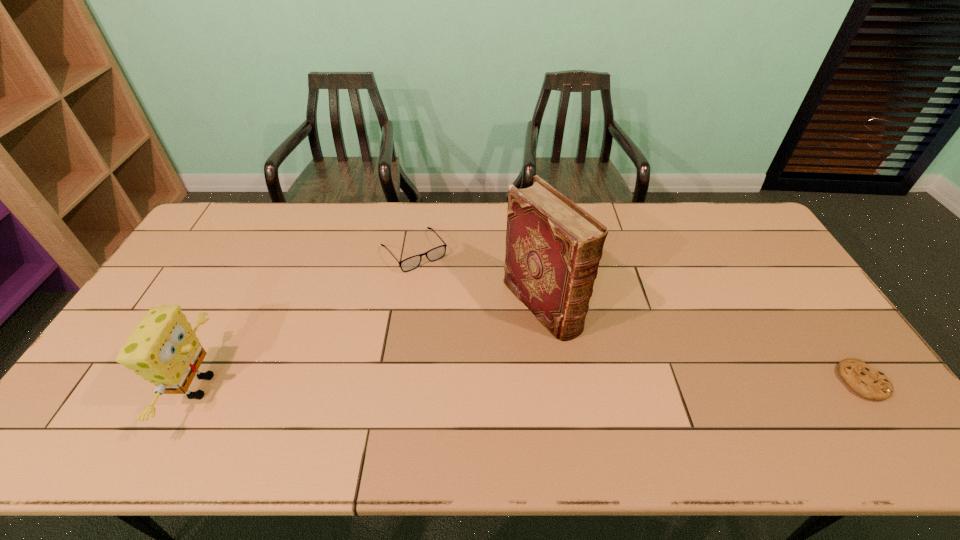
Image resolution: width=960 pixels, height=540 pixels. Identify the location of the leftmost object. (163, 349).

Where is `sponge`? sponge is located at coordinates (163, 349).

Find the location of a particular element. cookie is located at coordinates (869, 383).

Locate an element on the screen. This screenshot has width=960, height=540. the rightmost object is located at coordinates (869, 383).

This screenshot has width=960, height=540. Find the location of `the second object from left to right`. the second object from left to right is located at coordinates point(411,263).

This screenshot has width=960, height=540. In order to click on the second shortest object in this screenshot , I will do `click(411, 263)`.

Identify the location of the tallest object. The width and height of the screenshot is (960, 540). (553, 247).

Locate an element on the screen. The height and width of the screenshot is (540, 960). the second object from right to left is located at coordinates (553, 247).

Find the location of `free space located on the face of the third shortest object`. free space located on the face of the third shortest object is located at coordinates (348, 387).

This screenshot has width=960, height=540. I want to click on free spot located 0.250m on the back of the cookie, so click(x=801, y=293).